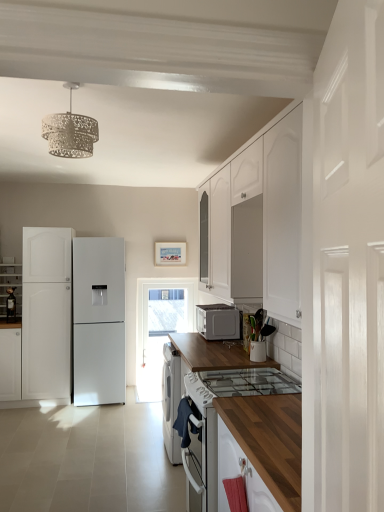
Question: Should I look upward or downward to see white matte cabinet at left, arranged as the 2th cabinetry when viewed from the left?

Choices:
 (A) down
 (B) up

Answer: (A)

Question: Considering the relative sizes of white textured chandelier at upper center and white matte microwave at center in the image provided, is white textured chandelier at upper center shorter than white matte microwave at center?

Choices:
 (A) yes
 (B) no

Answer: (B)

Question: Is white textured chandelier at upper center touching white matte microwave at center?

Choices:
 (A) no
 (B) yes

Answer: (A)

Question: Is white matte microwave at center a part of white textured chandelier at upper center?

Choices:
 (A) no
 (B) yes

Answer: (A)

Question: Is white textured chandelier at upper center thinner than white matte microwave at center?

Choices:
 (A) yes
 (B) no

Answer: (A)

Question: From a real-world perspective, is white textured chandelier at upper center located higher than white matte microwave at center?

Choices:
 (A) yes
 (B) no

Answer: (A)

Question: Is white textured chandelier at upper center positioned beyond the bounds of white matte microwave at center?

Choices:
 (A) yes
 (B) no

Answer: (A)

Question: Can you confirm if transparent glass door at center is positioned to the left of white glossy refrigerator at left, arranged as the first cabinetry when viewed from the left?

Choices:
 (A) no
 (B) yes

Answer: (A)

Question: Is transparent glass door at center not within white glossy refrigerator at left, the 3th cabinetry from the right?

Choices:
 (A) yes
 (B) no

Answer: (A)

Question: Would you say white glossy refrigerator at left, arranged as the first cabinetry when viewed from the left, is part of transparent glass door at center's contents?

Choices:
 (A) yes
 (B) no

Answer: (B)

Question: Is transparent glass door at center behind white glossy refrigerator at left, the 3th cabinetry from the right?

Choices:
 (A) yes
 (B) no

Answer: (A)

Question: Does transparent glass door at center turn towards white glossy refrigerator at left, the 3th cabinetry from the right?

Choices:
 (A) yes
 (B) no

Answer: (B)

Question: From a real-world perspective, is transparent glass door at center on top of white glossy refrigerator at left, arranged as the first cabinetry when viewed from the left?

Choices:
 (A) yes
 (B) no

Answer: (B)

Question: Considering the relative sizes of white glossy refrigerator at left, arranged as the first cabinetry when viewed from the left, and white glossy door at right in the image provided, is white glossy refrigerator at left, arranged as the first cabinetry when viewed from the left, thinner than white glossy door at right?

Choices:
 (A) yes
 (B) no

Answer: (B)